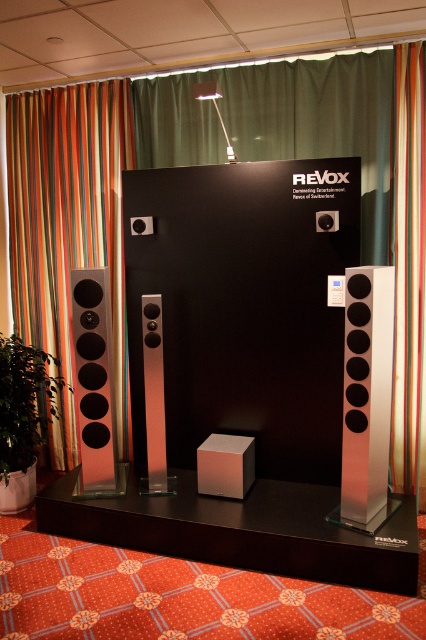
You are an interior designer planning to place the silver metallic speaker at center in a room with a striped fabric at left. Based on the REVOX display setup, will the speaker be visible from the main entrance? Explain your reasoning.

The silver metallic speaker at center is behind the striped fabric at left, so it might be partially or fully obscured depending on the fabric density. However, since the REVOX display shows it arranged symmetrically with other equipment, the speaker is likely positioned to remain visible through or around the fabric in the setup.